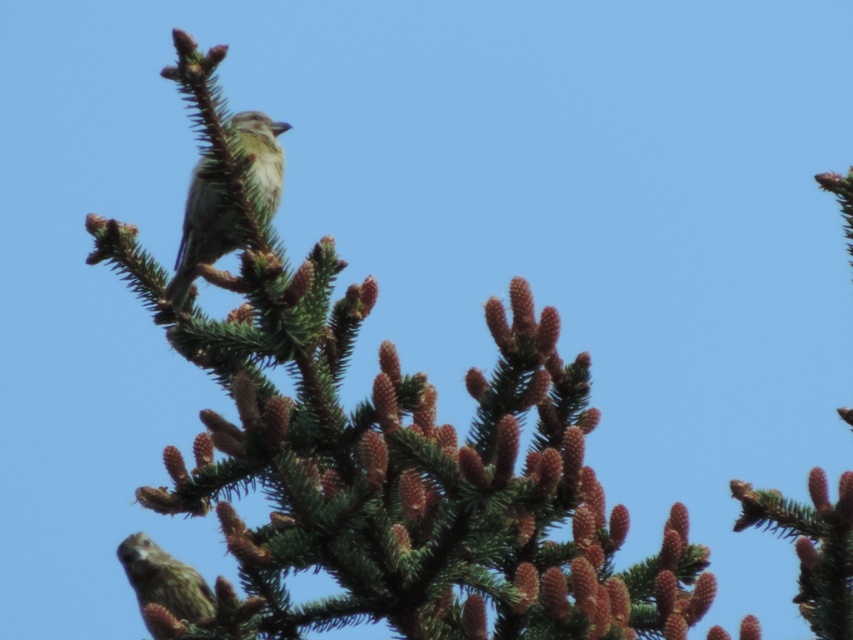
You are a birdwatcher observing the pine tree. You notice the green textured pine branch at upper center and the green speckled feathers at upper center. Which object is closer to you?

The green textured pine branch at upper center is closer to you because it is in front of the green speckled feathers at upper center.

You are standing in front of the pine tree and want to determine which of the two points, point (577, 449) or point (189, 212), is closer to you. Based on the image, which point is nearer?

Point (577, 449) is closer to the viewer than point (189, 212).

You are a birdwatcher observing the pine tree. You notice two birds with distinct feather patterns. The first has brown speckled feathers at center and the second has green speckled feathers at upper center. Which bird has a larger size?

The brown speckled feathers at center is larger in size than the green speckled feathers at upper center, so the bird with brown speckled feathers at center is larger.